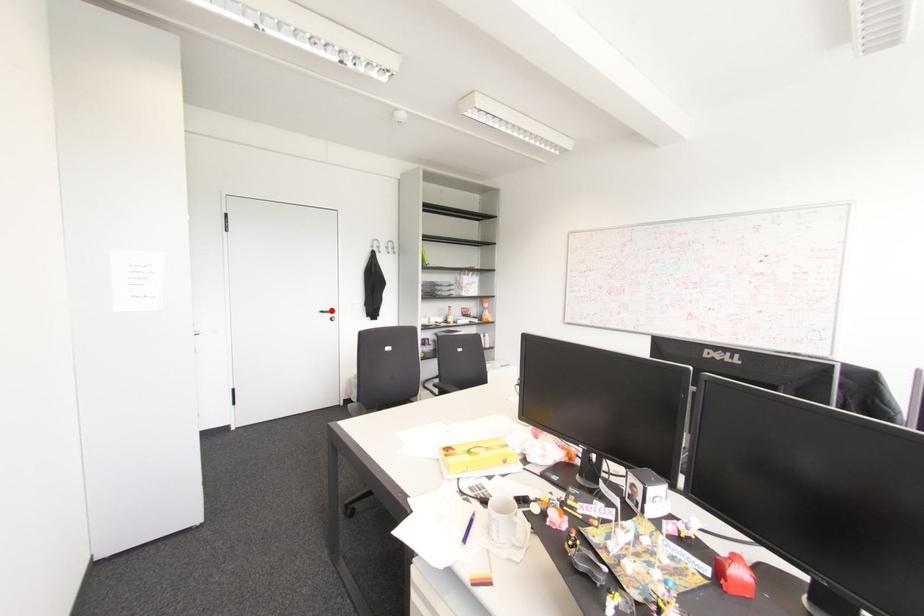
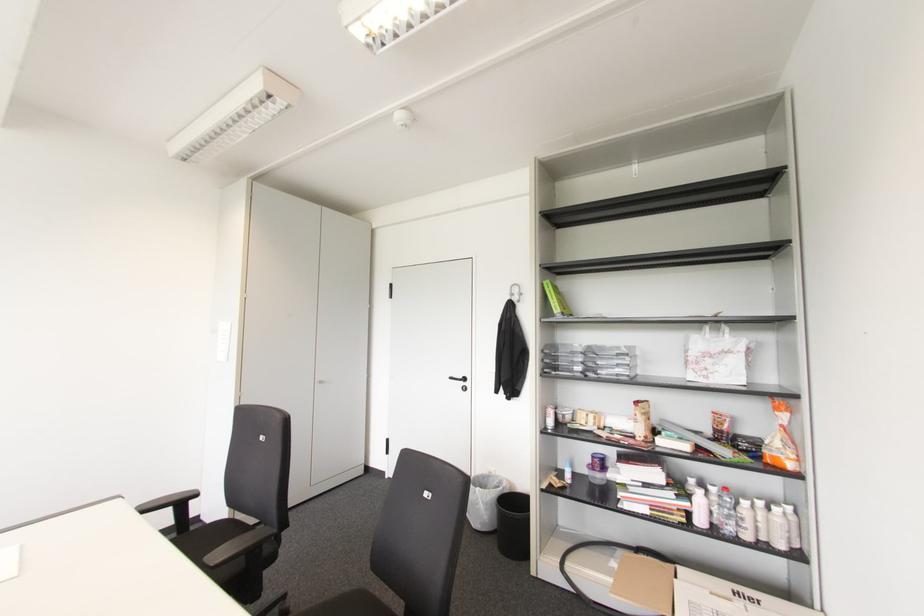
In the second image, find the point that corresponds to the highlighted location in the first image.

(464, 379)